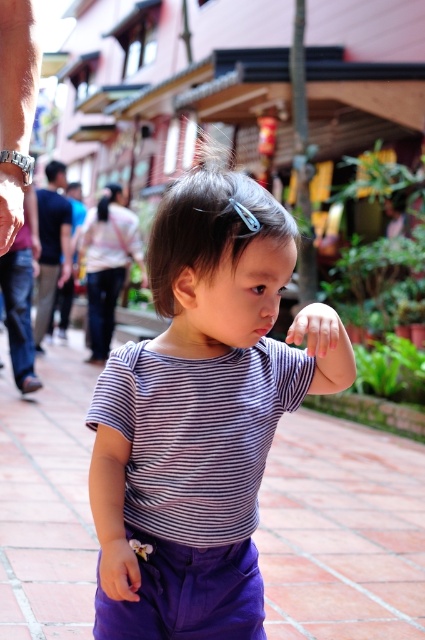
Question: Which point appears farthest from the camera in this image?

Choices:
 (A) (28, 412)
 (B) (23, 273)

Answer: (B)

Question: Is striped fabric toddler at center positioned behind denim jeans at left?

Choices:
 (A) no
 (B) yes

Answer: (A)

Question: Which point is closer to the camera?

Choices:
 (A) denim jeans at left
 (B) striped fabric toddler at center
 (C) black cotton shirt at left
 (D) purple fabric pants at center

Answer: (B)

Question: Is striped fabric toddler at center smaller than denim jeans at left?

Choices:
 (A) yes
 (B) no

Answer: (A)

Question: Does purple fabric pants at center appear on the left side of black cotton shirt at left?

Choices:
 (A) yes
 (B) no

Answer: (B)

Question: Which point is farther to the camera?

Choices:
 (A) striped fabric toddler at center
 (B) black cotton shirt at left
 (C) purple fabric pants at center
 (D) denim jeans at left

Answer: (B)